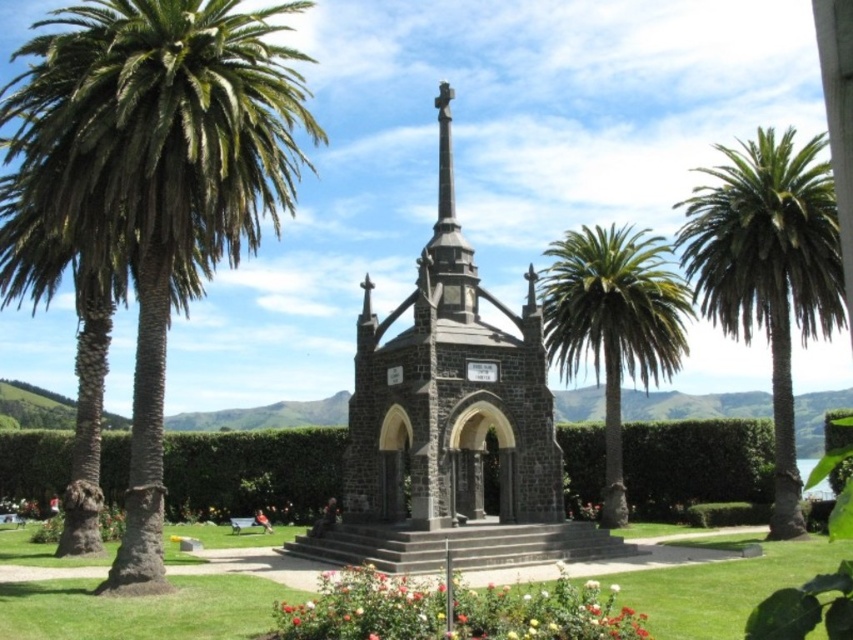
Where is `green leafy palm tree at center`? This screenshot has width=853, height=640. green leafy palm tree at center is located at coordinates (613, 324).

Can you confirm if green leafy palm tree at center is taller than green leafy hedge at center?

Yes, green leafy palm tree at center is taller than green leafy hedge at center.

Which is behind, point (589, 317) or point (637, 506)?

The point (637, 506) is behind.

Find the location of a particular element. green leafy palm tree at center is located at coordinates (613, 324).

Which of these two, green leafy palm at left or multicolored petals at lower center, stands taller?

green leafy palm at left is taller.

Can you confirm if green leafy palm at left is positioned to the right of multicolored petals at lower center?

Incorrect, green leafy palm at left is not on the right side of multicolored petals at lower center.

Where is `green leafy palm at left`? The image size is (853, 640). green leafy palm at left is located at coordinates (160, 173).

Locate an element on the screen. green leafy palm at left is located at coordinates (160, 173).

From the picture: Between green leafy hedge at center and white matte flower at center, which one has less height?

white matte flower at center is shorter.

This screenshot has height=640, width=853. Describe the element at coordinates (695, 465) in the screenshot. I see `green leafy hedge at center` at that location.

Where is `green leafy hedge at center`? The height and width of the screenshot is (640, 853). green leafy hedge at center is located at coordinates (695, 465).